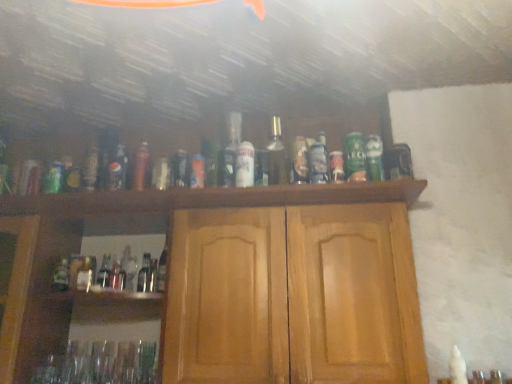
Question: Can you confirm if white matte can at center, acting as the 1th beer starting from the left, is shorter than matte glass bottle at center, the sixth bottle from the left?

Choices:
 (A) no
 (B) yes

Answer: (A)

Question: Can you confirm if white matte can at center, which ranks as the second beer in right-to-left order, is smaller than matte glass bottle at center, the fifth bottle in the right-to-left sequence?

Choices:
 (A) yes
 (B) no

Answer: (B)

Question: Is white matte can at center, acting as the 1th beer starting from the left, oriented away from matte glass bottle at center, the fifth bottle in the right-to-left sequence?

Choices:
 (A) yes
 (B) no

Answer: (B)

Question: Is the depth of white matte can at center, acting as the 1th beer starting from the left, greater than that of matte glass bottle at center, the sixth bottle from the left?

Choices:
 (A) no
 (B) yes

Answer: (A)

Question: Is white matte can at center, acting as the 1th beer starting from the left, closer to camera compared to matte glass bottle at center, the fifth bottle in the right-to-left sequence?

Choices:
 (A) yes
 (B) no

Answer: (A)

Question: Is white matte can at center, which ranks as the second beer in right-to-left order, taller than matte glass bottle at center, the fifth bottle in the right-to-left sequence?

Choices:
 (A) no
 (B) yes

Answer: (B)

Question: From a real-world perspective, is metallic gold bottle at center, arranged as the 5th bottle when viewed from the left, positioned under clear glass bottle at center, the seventh bottle positioned from the right, based on gravity?

Choices:
 (A) no
 (B) yes

Answer: (A)

Question: Is the depth of metallic gold bottle at center, placed as the 6th bottle when sorted from right to left, greater than that of clear glass bottle at center, the seventh bottle positioned from the right?

Choices:
 (A) no
 (B) yes

Answer: (A)

Question: Is metallic gold bottle at center, arranged as the 5th bottle when viewed from the left, taller than clear glass bottle at center, the fourth bottle from the left?

Choices:
 (A) yes
 (B) no

Answer: (B)

Question: Is clear glass bottle at center, the seventh bottle positioned from the right, inside metallic gold bottle at center, arranged as the 5th bottle when viewed from the left?

Choices:
 (A) yes
 (B) no

Answer: (B)

Question: Does metallic gold bottle at center, arranged as the 5th bottle when viewed from the left, turn towards clear glass bottle at center, the fourth bottle from the left?

Choices:
 (A) no
 (B) yes

Answer: (A)

Question: Is metallic gold bottle at center, placed as the 6th bottle when sorted from right to left, in contact with clear glass bottle at center, the fourth bottle from the left?

Choices:
 (A) no
 (B) yes

Answer: (A)

Question: Is matte glass bottle at center, marked as the 3th bottle in a right-to-left arrangement, wider than white matte can at center, acting as the 1th beer starting from the left?

Choices:
 (A) no
 (B) yes

Answer: (A)